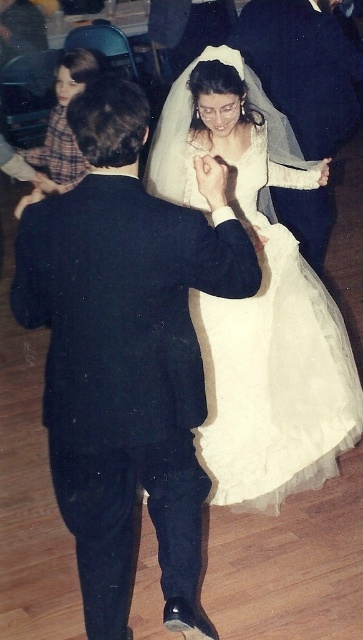
Question: Which of the following is the farthest from the observer?

Choices:
 (A) matte black suit at center
 (B) dark blue suit at center
 (C) white tulle dress at center

Answer: (A)

Question: Which object is the farthest from the dark blue suit at center?

Choices:
 (A) matte black suit at center
 (B) white tulle dress at center

Answer: (A)

Question: Does dark blue suit at center appear under white tulle dress at center?

Choices:
 (A) no
 (B) yes

Answer: (B)

Question: Is dark blue suit at center to the right of white tulle dress at center from the viewer's perspective?

Choices:
 (A) yes
 (B) no

Answer: (B)

Question: Estimate the real-world distances between objects in this image. Which object is farther from the white tulle dress at center?

Choices:
 (A) dark blue suit at center
 (B) matte black suit at center

Answer: (B)

Question: Is white tulle dress at center to the left of matte black suit at center from the viewer's perspective?

Choices:
 (A) no
 (B) yes

Answer: (B)